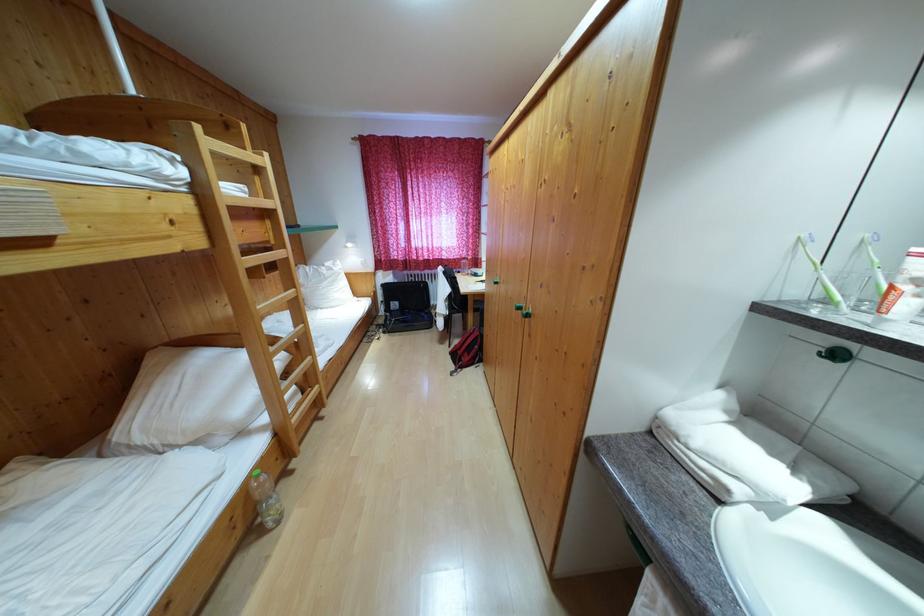
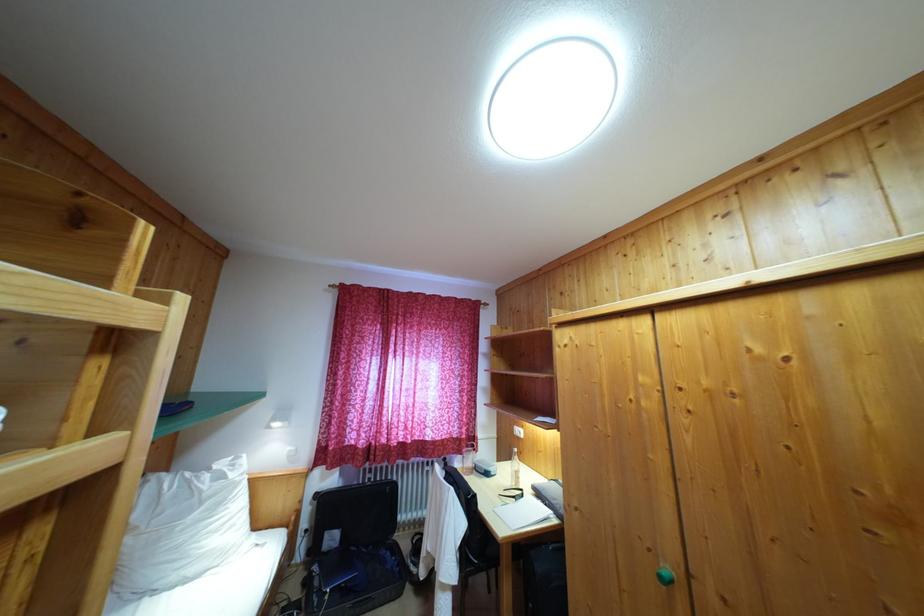
Where in the second image is the point corresponding to point 327,273 from the first image?

(213, 476)